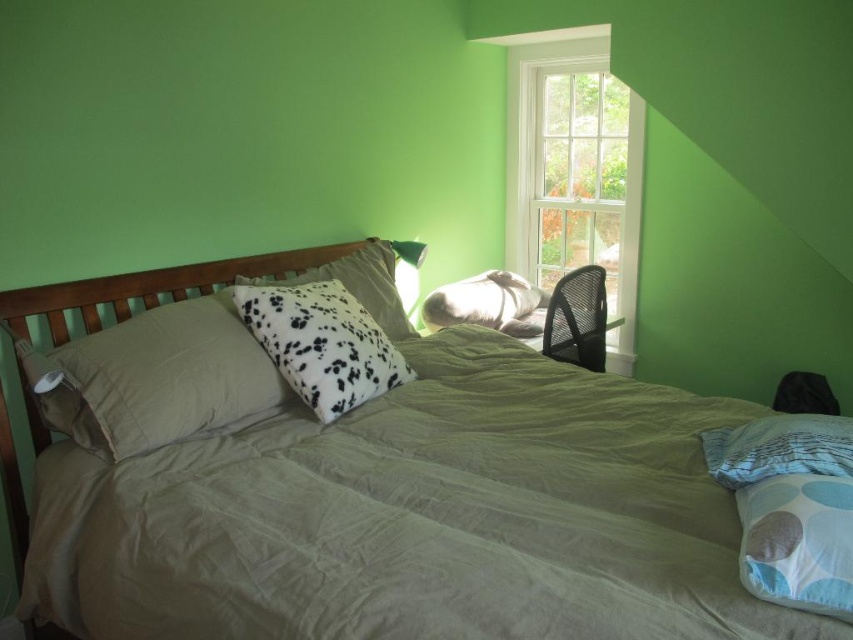
Does matte khaki bed at center have a lesser width compared to light blue fabric pillow at lower right?

Incorrect, matte khaki bed at center's width is not less than light blue fabric pillow at lower right's.

Is matte khaki bed at center to the left of light blue fabric pillow at lower right from the viewer's perspective?

Yes, matte khaki bed at center is to the left of light blue fabric pillow at lower right.

Who is more forward, (148, 294) or (819, 541)?

Positioned in front is point (819, 541).

The width and height of the screenshot is (853, 640). What are the coordinates of `matte khaki bed at center` in the screenshot? It's located at (152, 285).

Looking at this image, can you confirm if white dotted pillow at center is positioned above white dotted pillow at upper center?

Actually, white dotted pillow at center is below white dotted pillow at upper center.

Looking at this image, who is higher up, white dotted pillow at center or white dotted pillow at upper center?

white dotted pillow at upper center is higher up.

Measure the distance between point (286, 285) and camera.

A distance of 6.90 feet exists between point (286, 285) and camera.

The width and height of the screenshot is (853, 640). What are the coordinates of `white dotted pillow at center` in the screenshot? It's located at (322, 342).

Can you confirm if satin beige pillow at left is thinner than white dotted pillow at center?

No, satin beige pillow at left is not thinner than white dotted pillow at center.

Does satin beige pillow at left have a greater height compared to white dotted pillow at center?

Correct, satin beige pillow at left is much taller as white dotted pillow at center.

Image resolution: width=853 pixels, height=640 pixels. I want to click on satin beige pillow at left, so click(x=161, y=378).